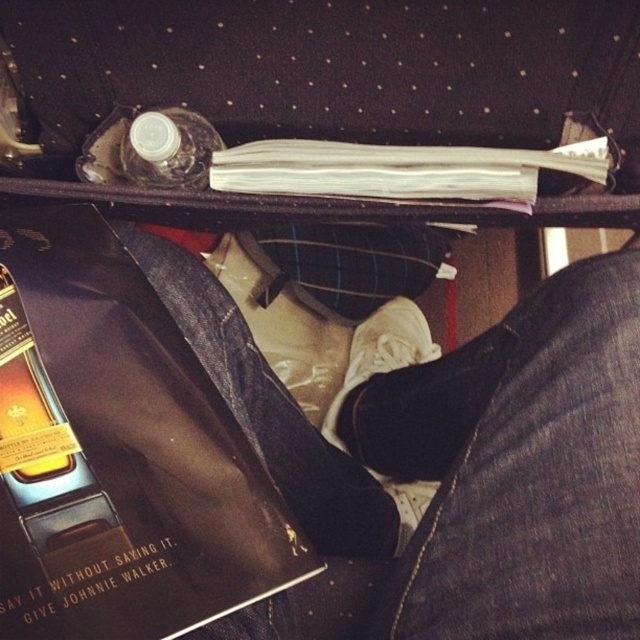
Question: Where is white paper book at upper center located in relation to white suede shoe at lower center in the image?

Choices:
 (A) left
 (B) right

Answer: (B)

Question: Which point is farther to the camera?

Choices:
 (A) (157, 145)
 (B) (372, 352)
 (C) (220, 589)
 (D) (362, 196)

Answer: (B)

Question: Which object is positioned closest to the white paper book at upper center?

Choices:
 (A) white suede shoe at lower center
 (B) transparent plastic bottle at upper center

Answer: (B)

Question: Among these objects, which one is farthest from the camera?

Choices:
 (A) shiny leather book at lower left
 (B) white paper book at upper center
 (C) white suede shoe at lower center

Answer: (C)

Question: Considering the relative positions of shiny leather book at lower left and white paper book at upper center in the image provided, where is shiny leather book at lower left located with respect to white paper book at upper center?

Choices:
 (A) right
 (B) left

Answer: (B)

Question: Is shiny leather book at lower left wider than white suede shoe at lower center?

Choices:
 (A) yes
 (B) no

Answer: (A)